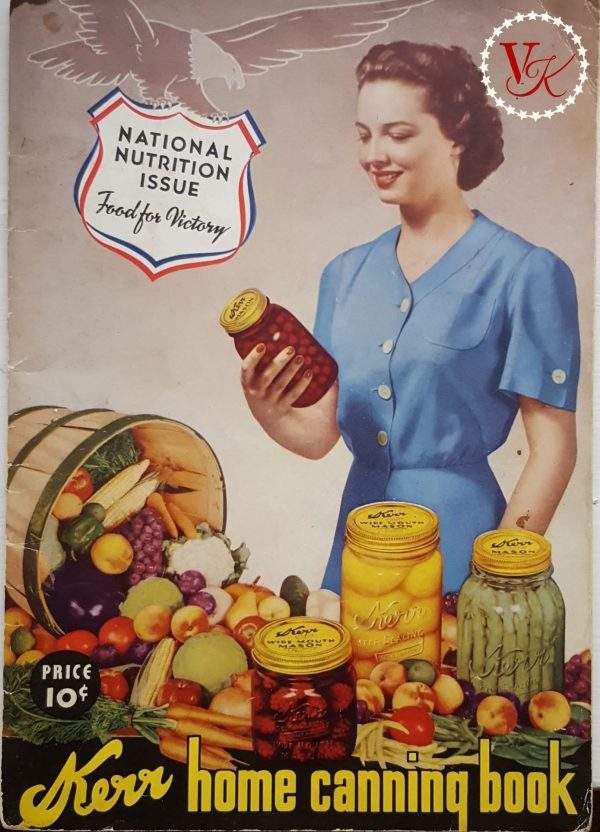
Identify the location of mason jars. (300, 700), (387, 650), (525, 651), (322, 379).